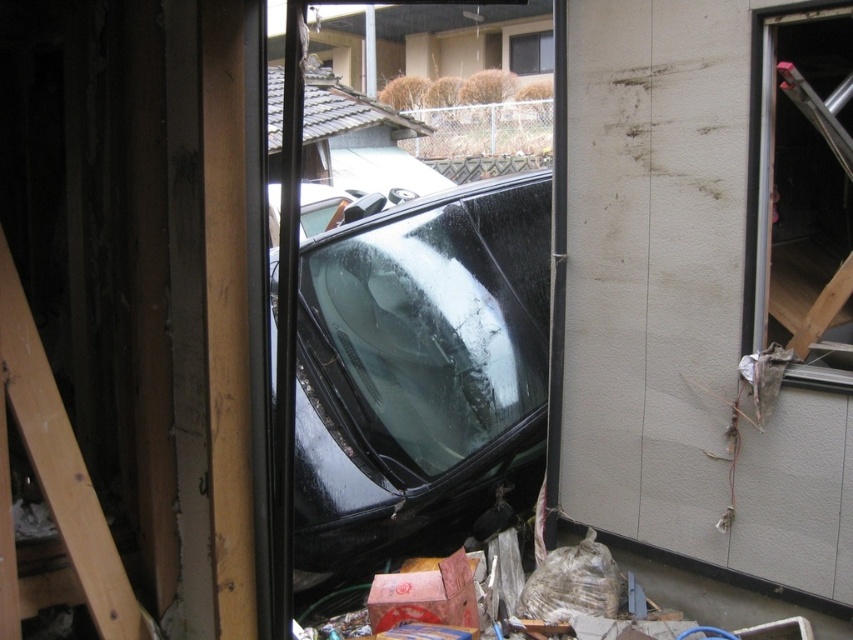
You are standing inside a building and looking through the transparent glass window at right and the wooden at left. Which object is closer to you, the observer?

The wooden at left is closer to you because it is positioned nearer than the transparent glass window at right, which is further away.

You are a contractor assessing the damage to the building. You need to replace the windows. Which window, the transparent glass window at right or the clear glass window at upper center, requires a wider pane of glass?

The transparent glass window at right requires a wider pane of glass because its width is larger than the clear glass window at upper center.

You are a delivery person trying to reach a package left on the sidewalk outside. The transparent glass window at right and the clear glass window at upper center are part of the building you need to navigate around. Given that your delivery cart is 4 feet wide, can you pass through the space between these two windows?

The transparent glass window at right and the clear glass window at upper center are 30.46 feet apart from each other. Since your delivery cart is only 4 feet wide, there is more than enough space to pass through the 30.46 feet gap between them.